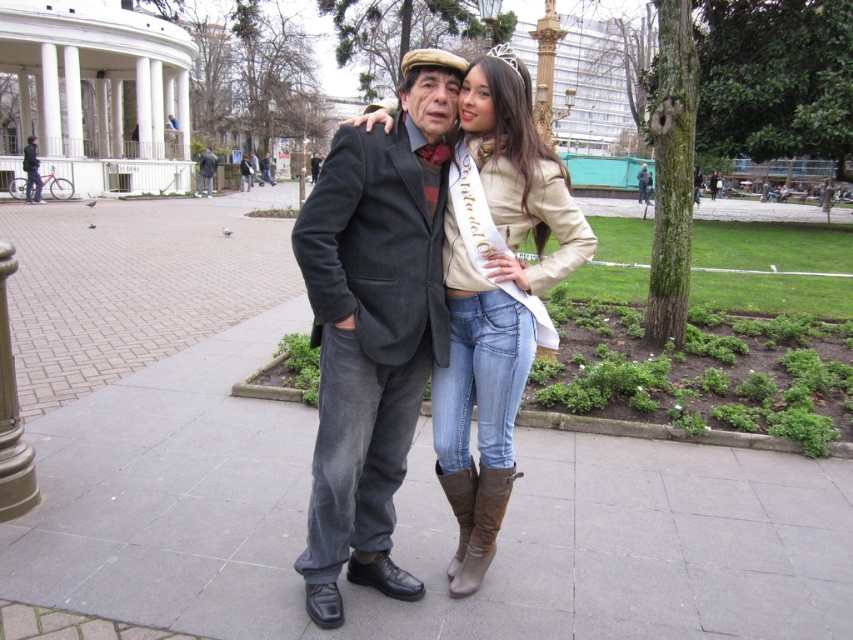
You are a photographer standing at the camera position. You want to adjust your zoom lens to ensure the dark gray wool suit at center fills the frame. Given that the optimal framing requires the subject to be exactly 2 meters away, should you zoom in or out?

The dark gray wool suit at center is currently 2.32 meters away from the camera. Since this distance is greater than the optimal 2 meters, you should zoom in to bring the subject closer to the desired framing distance.

From the picture: You are a photographer trying to capture the two people in the image. The dark gray wool suit at center and the brown suede boot at lower right are in your viewfinder. Based on their positions, which object is closer to the left edge of your frame?

The dark gray wool suit at center is closer to the left edge of the frame because it is positioned to the left of the brown suede boot at lower right.

Based on the photo, you are a photographer trying to capture a closeup shot of the dark gray wool suit at center and the leather boots at center. Your camera has a maximum focus range of 10 inches. Will you be able to focus on both subjects simultaneously?

The dark gray wool suit at center and leather boots at center are 10.76 inches apart. Since the distance between them exceeds the camera focus range of 10 inches, you will not be able to focus on both subjects simultaneously.